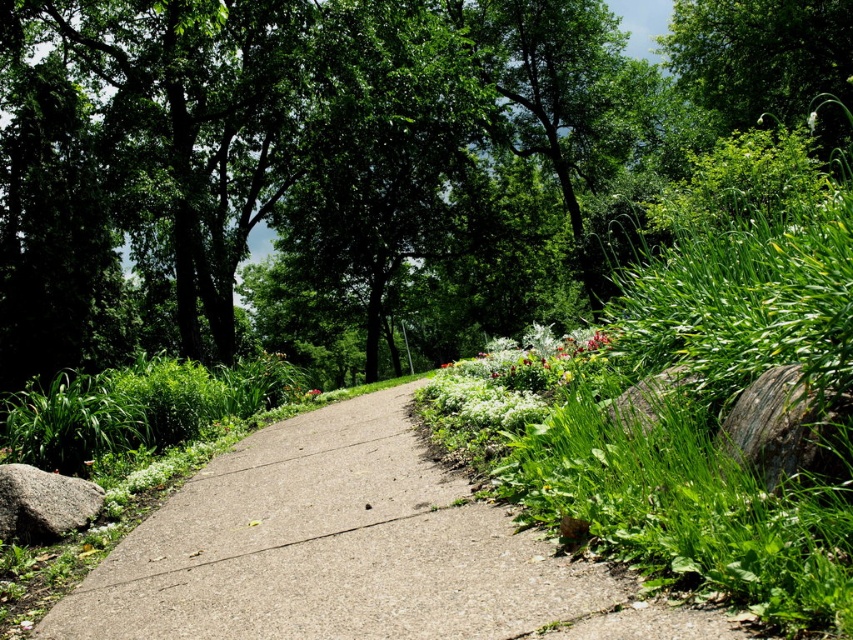
Does point (595, 568) lie behind point (508, 380)?

No, it is not.

You are a GUI agent. You are given a task and a screenshot of the screen. Output one action in this format:
    pyautogui.click(x=<x>, y=<y>)
    Task: Click on the gray concrete pavement at center
    The image size is (853, 640).
    Given the screenshot: What is the action you would take?
    point(349,552)

At what (x,y) coordinates should I click in order to perform the action: click on gray concrete pavement at center. Please return your answer as a coordinate pair (x, y). This screenshot has width=853, height=640. Looking at the image, I should click on (349, 552).

Is point (410, 534) more distant than point (759, 433)?

That is True.

Between gray concrete pavement at center and gray rough rock at right, which one appears on the left side from the viewer's perspective?

gray concrete pavement at center is more to the left.

Where is `gray concrete pavement at center`? Image resolution: width=853 pixels, height=640 pixels. gray concrete pavement at center is located at coordinates (349, 552).

Where is `gray concrete pavement at center`? The height and width of the screenshot is (640, 853). gray concrete pavement at center is located at coordinates (349, 552).

What are the coordinates of `white matte flowers at center` in the screenshot? It's located at tap(511, 378).

Is point (563, 378) closer to viewer compared to point (763, 417)?

No.

This screenshot has width=853, height=640. What are the coordinates of `white matte flowers at center` in the screenshot? It's located at (511, 378).